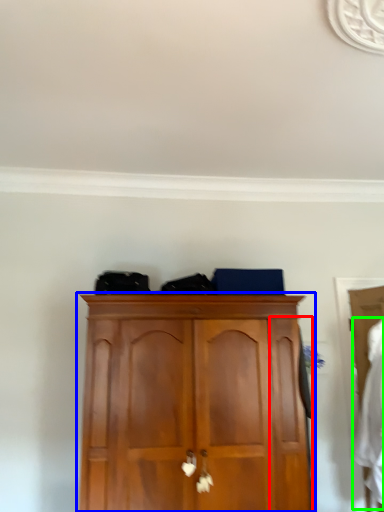
Question: Which object is positioned farthest from door (highlighted by a red box)? Select from cupboard (highlighted by a blue box) and clothing (highlighted by a green box).

Choices:
 (A) cupboard
 (B) clothing

Answer: (B)